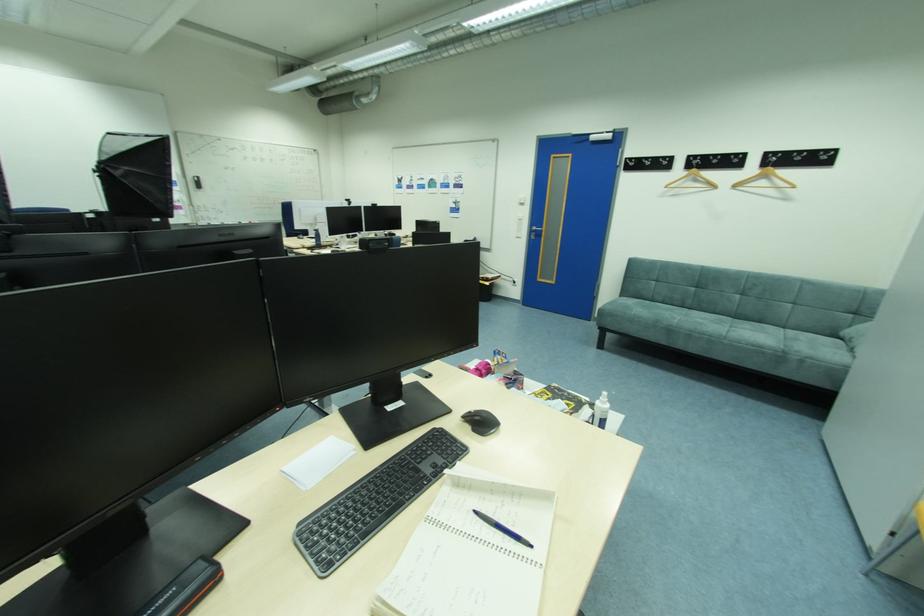
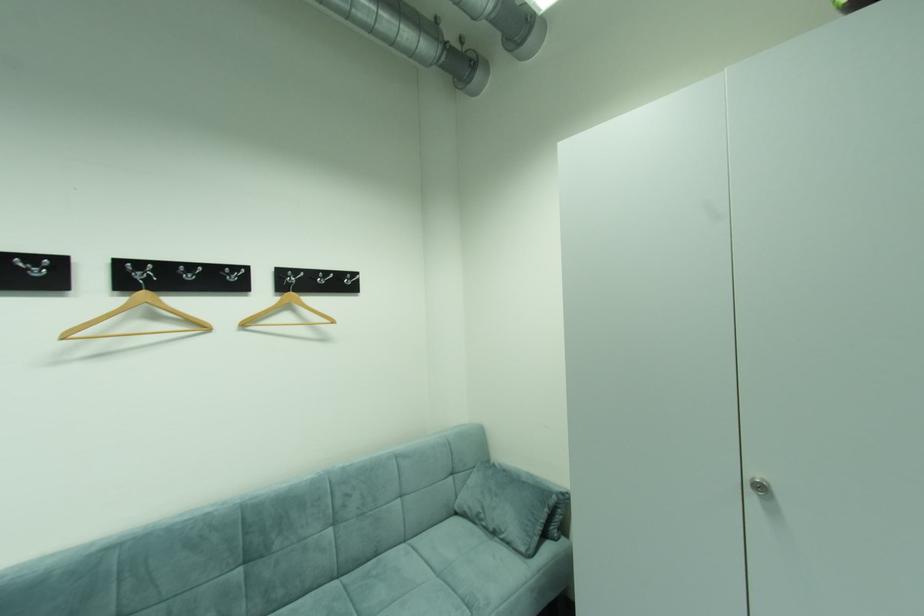
Locate, in the second image, the point that corresponds to point 768,323 in the first image.

(383, 554)